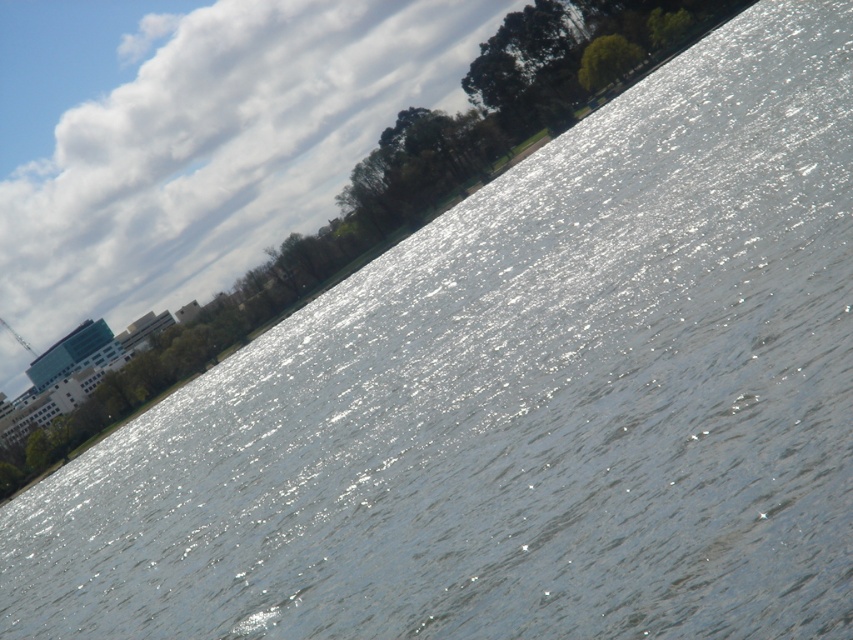
From the picture: Who is higher up, white fluffy cloud at upper left or green leafy tree at upper center?

white fluffy cloud at upper left

Can you confirm if white fluffy cloud at upper left is shorter than green leafy tree at upper center?

In fact, white fluffy cloud at upper left may be taller than green leafy tree at upper center.

Measure the distance between point [310,224] and camera.

They are 1126.87 feet apart.

This screenshot has width=853, height=640. In order to click on white fluffy cloud at upper left in this screenshot , I will do `click(194, 138)`.